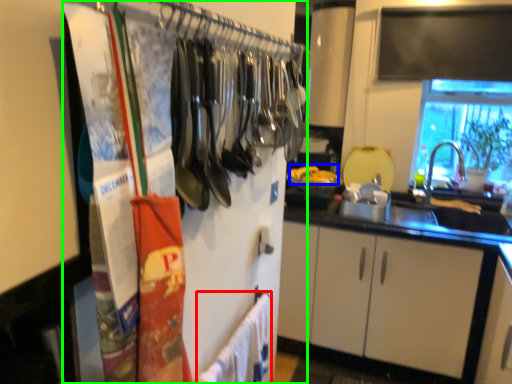
Question: Estimate the real-world distances between objects in this image. Which object is farther from bath towel (highlighted by a red box), food (highlighted by a blue box) or closet (highlighted by a green box)?

Choices:
 (A) food
 (B) closet

Answer: (A)